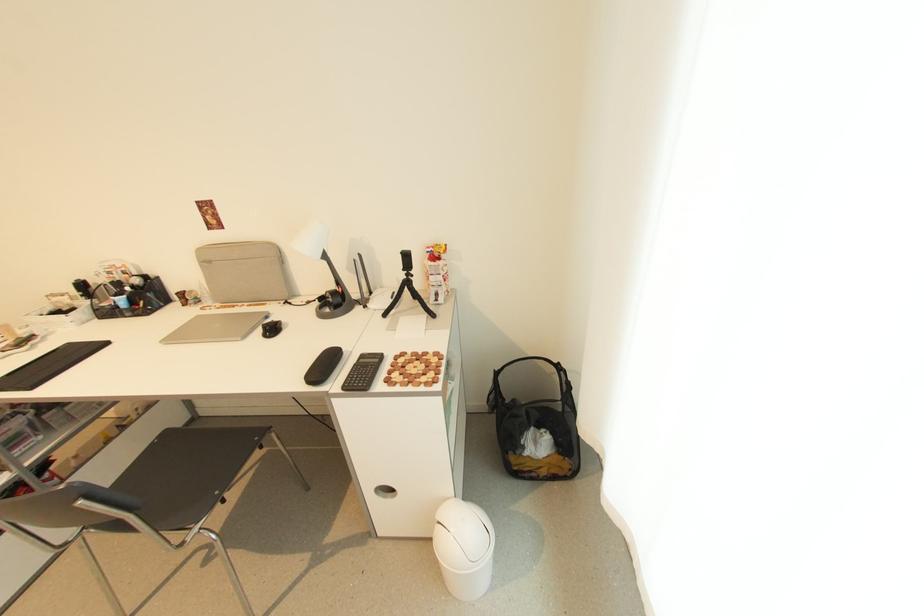
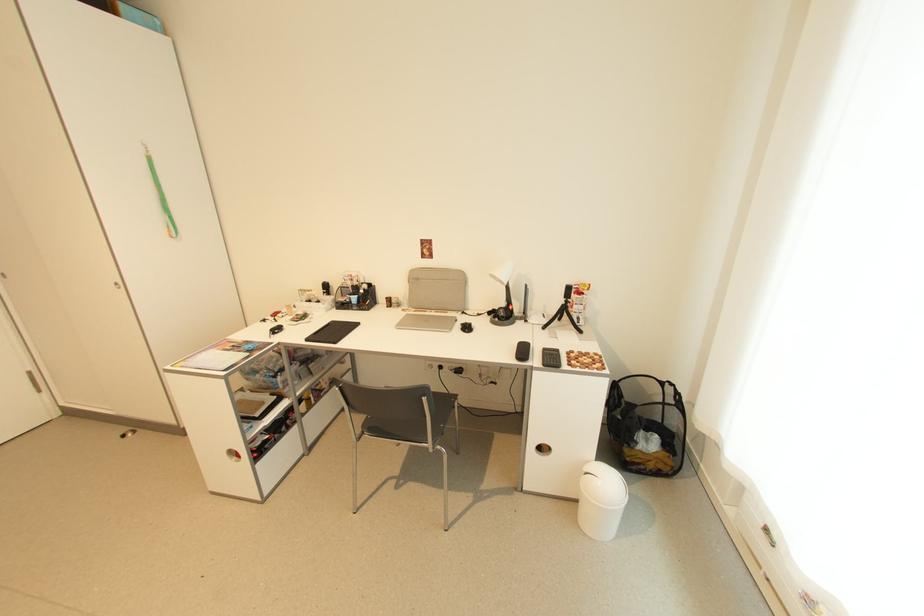
Where in the second image is the point corresponding to (336,288) from the first image?

(507, 306)